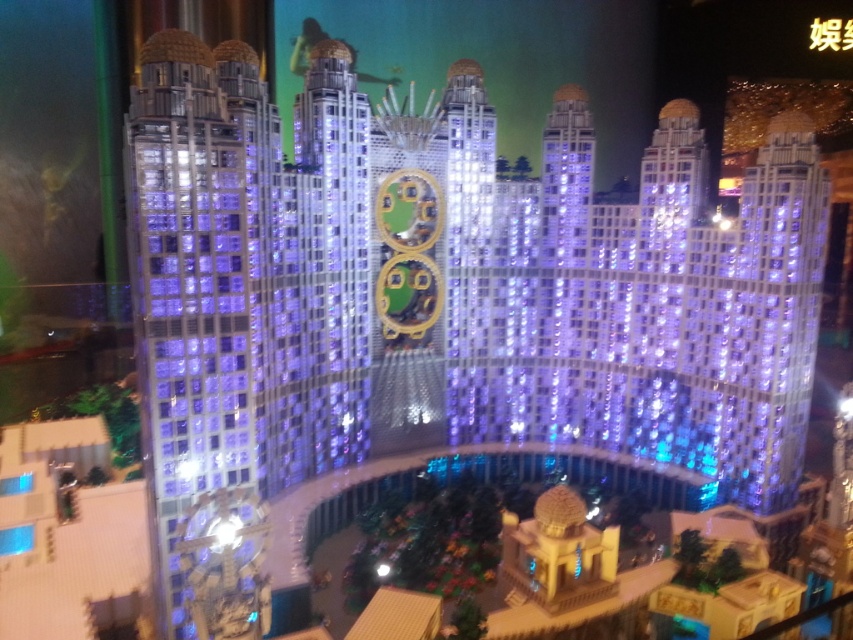
Question: Which point is closer to the camera?

Choices:
 (A) (358, 266)
 (B) (165, 42)

Answer: (B)

Question: Does transparent glass tower at left appear under lustrous glass skyscraper at right?

Choices:
 (A) yes
 (B) no

Answer: (B)

Question: Can you confirm if transparent glass tower at left is thinner than lustrous glass skyscraper at right?

Choices:
 (A) yes
 (B) no

Answer: (B)

Question: Estimate the real-world distances between objects in this image. Which object is closer to the transparent glass tower at left?

Choices:
 (A) lustrous glass skyscraper at right
 (B) shiny metallic building at center

Answer: (B)

Question: Among these objects, which one is farthest from the camera?

Choices:
 (A) transparent glass tower at left
 (B) shiny metallic building at center

Answer: (B)

Question: Can you confirm if transparent glass tower at left is positioned to the left of shiny metallic building at center?

Choices:
 (A) yes
 (B) no

Answer: (A)